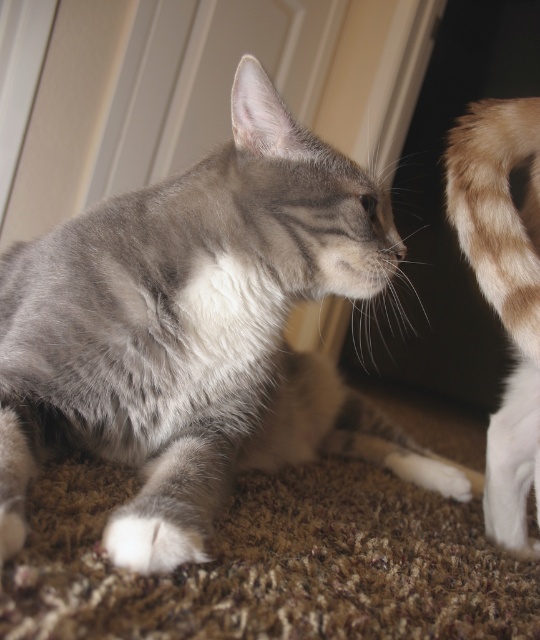
Does point (494, 518) come closer to viewer compared to point (174, 541)?

No, it is behind (174, 541).

You are a GUI agent. You are given a task and a screenshot of the screen. Output one action in this format:
    pyautogui.click(x=<x>, y=<y>)
    Task: Click on the light brown fur tail at right
    The width and height of the screenshot is (540, 640).
    Given the screenshot: What is the action you would take?
    pyautogui.click(x=503, y=291)

Is point (274, 461) positioned before point (462, 179)?

No, (274, 461) is behind (462, 179).

Can you confirm if gray soft fur cat at center is thinner than light brown fur tail at right?

Incorrect, gray soft fur cat at center's width is not less than light brown fur tail at right's.

The height and width of the screenshot is (640, 540). In order to click on gray soft fur cat at center in this screenshot , I will do `click(199, 324)`.

Is gray soft fur cat at center in front of white soft fur paw at lower left?

That is True.

Based on the photo, measure the distance between gray soft fur cat at center and camera.

They are 62.81 centimeters apart.

The image size is (540, 640). In order to click on gray soft fur cat at center in this screenshot , I will do `click(199, 324)`.